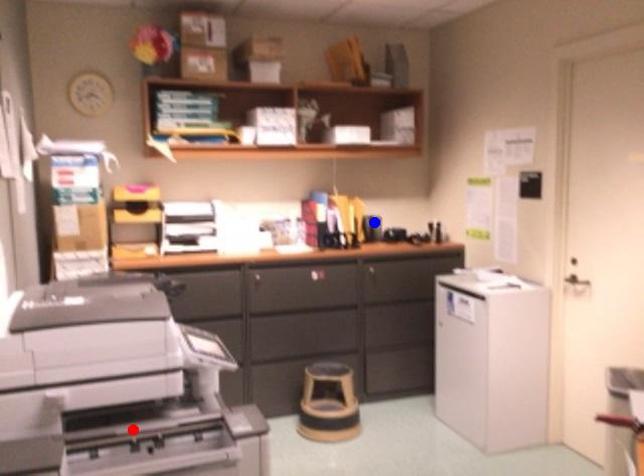
Question: Which of the two points in the image is closer to the camera?

Choices:
 (A) Blue point is closer.
 (B) Red point is closer.

Answer: (B)